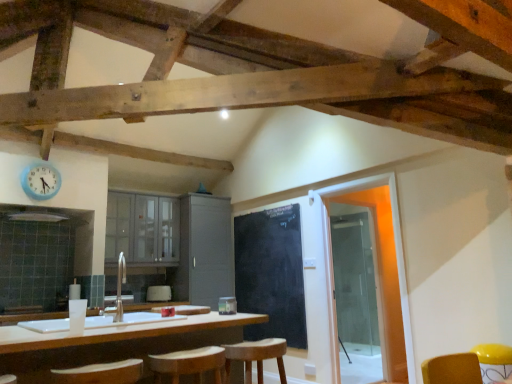
Question: Is matte gray cabinet at center, acting as the second cabinetry starting from the left, taller than wooden bar stool at center?

Choices:
 (A) yes
 (B) no

Answer: (A)

Question: Is matte gray cabinet at center, the 1th cabinetry positioned from the right, facing away from wooden bar stool at center?

Choices:
 (A) no
 (B) yes

Answer: (A)

Question: Considering the relative positions of matte gray cabinet at center, acting as the second cabinetry starting from the left, and wooden bar stool at center in the image provided, is matte gray cabinet at center, acting as the second cabinetry starting from the left, to the right of wooden bar stool at center from the viewer's perspective?

Choices:
 (A) yes
 (B) no

Answer: (B)

Question: Can you confirm if matte gray cabinet at center, acting as the second cabinetry starting from the left, is shorter than wooden bar stool at center?

Choices:
 (A) no
 (B) yes

Answer: (A)

Question: Can you confirm if matte gray cabinet at center, acting as the second cabinetry starting from the left, is thinner than wooden bar stool at center?

Choices:
 (A) no
 (B) yes

Answer: (A)

Question: In terms of size, does white glossy sink at center appear bigger or smaller than white matte countertop at center?

Choices:
 (A) small
 (B) big

Answer: (A)

Question: Considering the relative positions of white glossy sink at center and white matte countertop at center in the image provided, is white glossy sink at center to the left or to the right of white matte countertop at center?

Choices:
 (A) left
 (B) right

Answer: (A)

Question: Is white glossy sink at center wider or thinner than white matte countertop at center?

Choices:
 (A) wide
 (B) thin

Answer: (B)

Question: From the image's perspective, relative to white matte countertop at center, is white glossy sink at center above or below?

Choices:
 (A) below
 (B) above

Answer: (B)

Question: Do you think blue plastic clock at upper left is within white fabric armchair at center, or outside of it?

Choices:
 (A) outside
 (B) inside

Answer: (A)

Question: Would you say blue plastic clock at upper left is to the left or to the right of white fabric armchair at center in the picture?

Choices:
 (A) right
 (B) left

Answer: (B)

Question: From their relative heights in the image, would you say blue plastic clock at upper left is taller or shorter than white fabric armchair at center?

Choices:
 (A) short
 (B) tall

Answer: (B)

Question: From a real-world perspective, is blue plastic clock at upper left physically located above or below white fabric armchair at center?

Choices:
 (A) above
 (B) below

Answer: (A)

Question: Relative to wooden bar stool at center, is white glossy sink at center in front or behind?

Choices:
 (A) front
 (B) behind

Answer: (A)

Question: Which is correct: white glossy sink at center is inside wooden bar stool at center, or outside of it?

Choices:
 (A) outside
 (B) inside

Answer: (A)